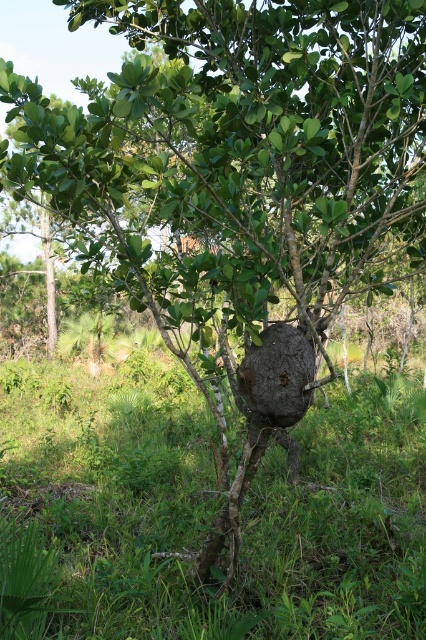
Between point (419, 529) and point (261, 358), which one is positioned in front?

Point (261, 358) is in front.

Is green grass at lower center positioned before brown rough rock at center?

Yes, it is in front of brown rough rock at center.

Is point (22, 588) closer to viewer compared to point (256, 346)?

Yes, point (22, 588) is closer to viewer.

Find the location of `green grass at lower center`. green grass at lower center is located at coordinates (206, 513).